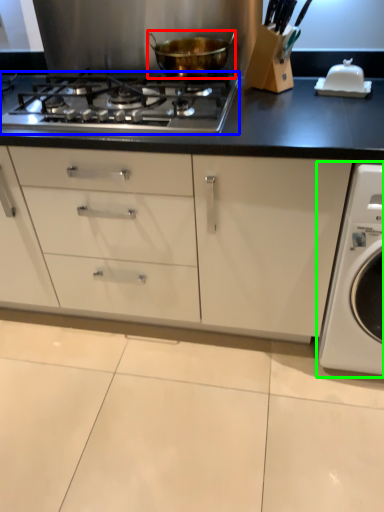
Question: Which is farther away from kitchen appliance (highlighted by a red box)? gas stove (highlighted by a blue box) or washing machine (highlighted by a green box)?

Choices:
 (A) gas stove
 (B) washing machine

Answer: (B)